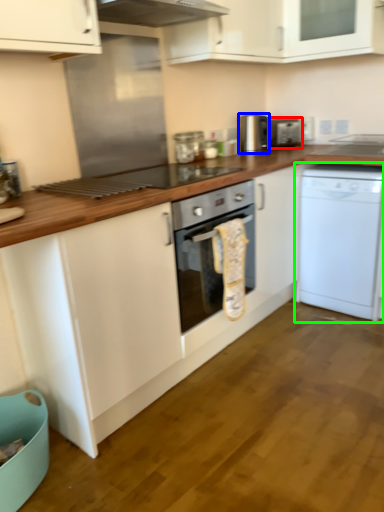
Question: Which object is the closest to the appliance (highlighted by a red box)? Choose among these: appliance (highlighted by a blue box) or dishwasher (highlighted by a green box).

Choices:
 (A) appliance
 (B) dishwasher

Answer: (A)